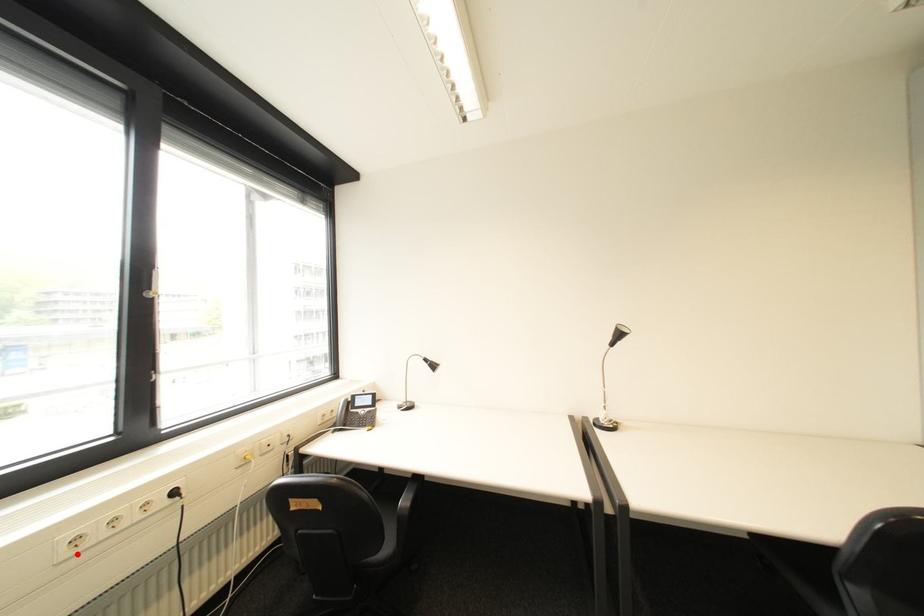
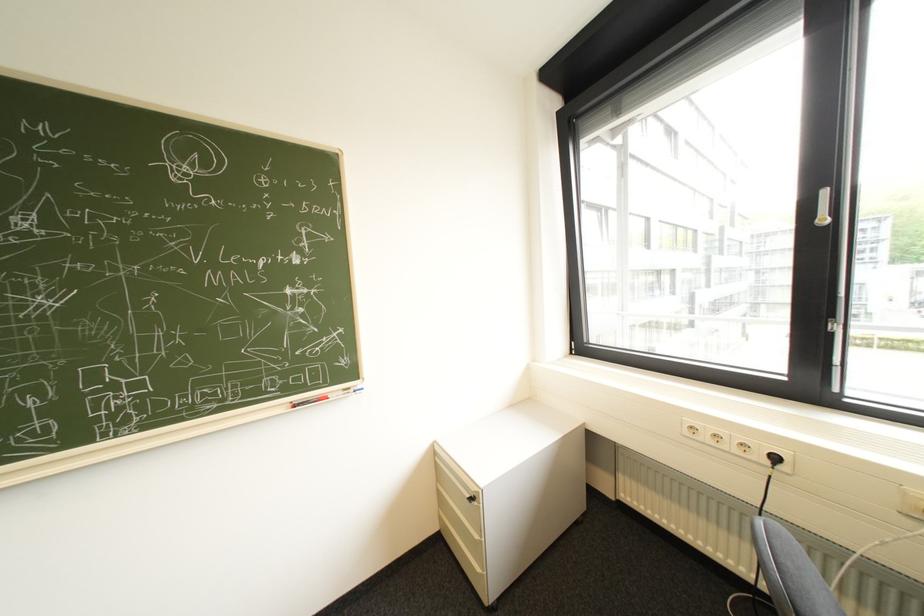
Question: I am providing you with two images of the same scene from different viewpoints. Given a red point in image1, look at the same physical point in image2. Is it:

Choices:
 (A) Closer to the viewpoint
 (B) Farther from the viewpoint

Answer: (B)